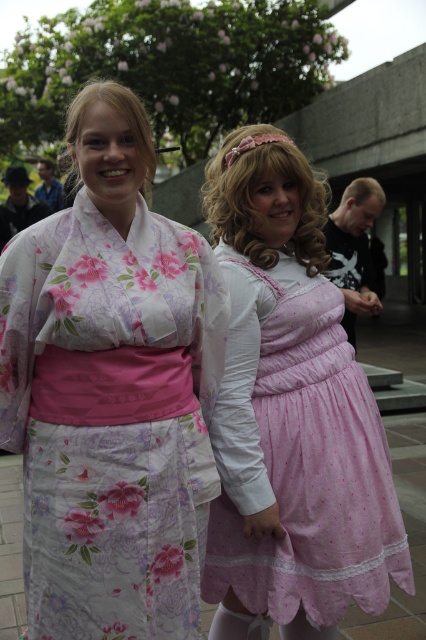
You are organizing a costume party and need to decide which outfit to wear. You have the floral silk kimono at center and the matte black shirt at right. Based on their sizes, which one would you choose if you want an outfit that stands out more visually?

The floral silk kimono at center has a larger size compared to matte black shirt at right, so it would stand out more visually and is the better choice.

You are organizing a photoshoot and need to position the pink satin dress at center and the matte black shirt at right in a way that follows the spatial arrangement seen in the image. Which object should be placed lower to maintain the original composition?

The pink satin dress at center should be placed lower than the matte black shirt at right to maintain the original composition, as it is located below the matte black shirt at right in the image.

You are a photographer setting up for a photoshoot. You need to position a tripod so that both the pink satin dress at center and the matte black shirt at right are in frame. Considering their heights, which object should be placed closer to the camera to ensure both are fully visible?

The pink satin dress at center is taller than the matte black shirt at right, so placing the taller pink satin dress at center closer to the camera will help ensure both are fully visible in the frame.